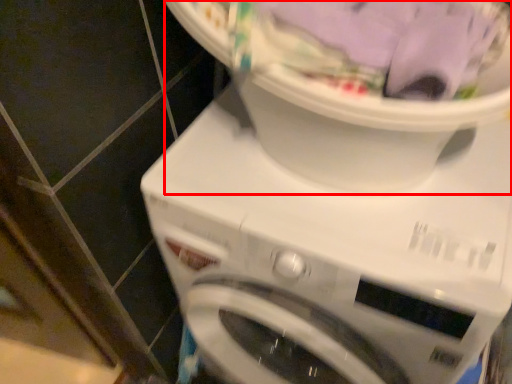
Question: Considering the relative positions of machine (annotated by the red box) and washing machine in the image provided, where is machine (annotated by the red box) located with respect to the staircase?

Choices:
 (A) right
 (B) left

Answer: (B)